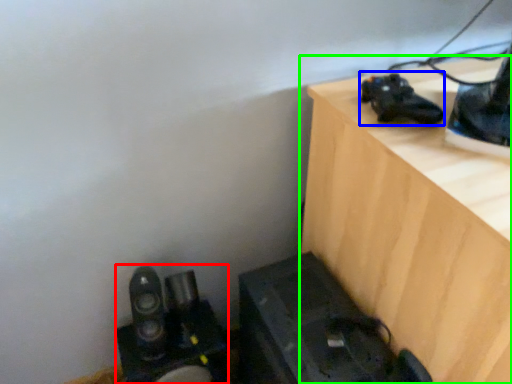
Question: Based on their relative distances, which object is farther from equipment (highlighted by a red box)? Choose from shoe (highlighted by a blue box) and furniture (highlighted by a green box).

Choices:
 (A) shoe
 (B) furniture

Answer: (A)